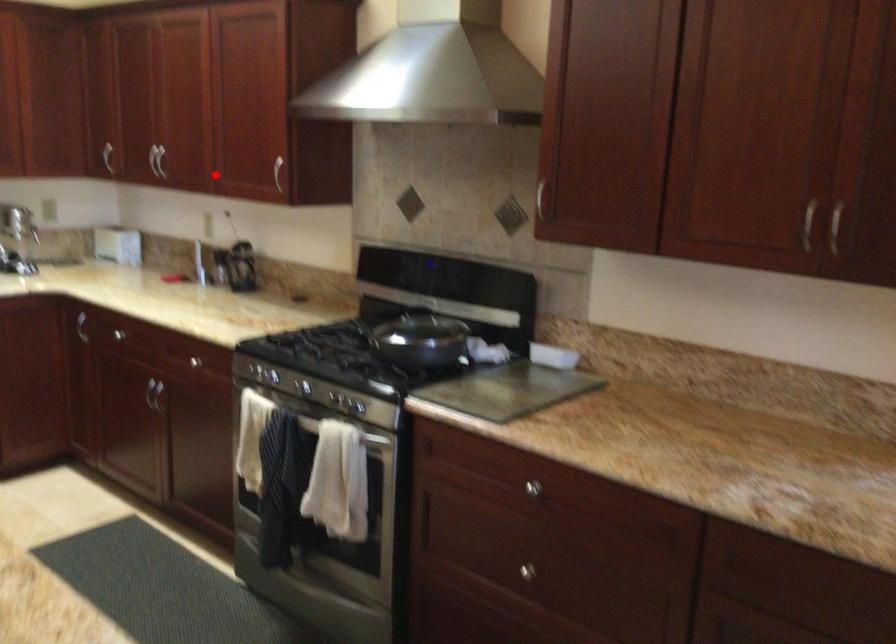
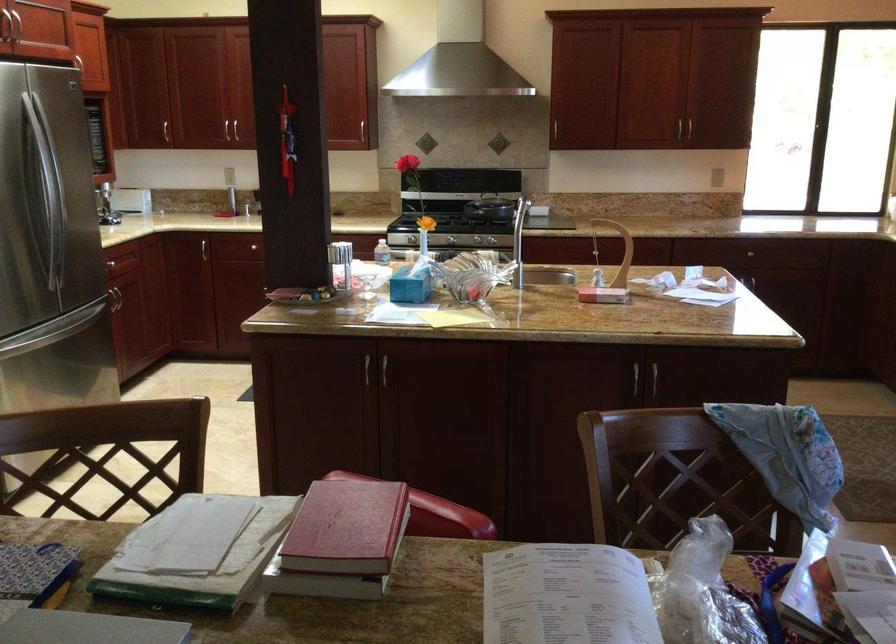
Find the pixel in the second image that matches the highlighted location in the first image.

(231, 131)